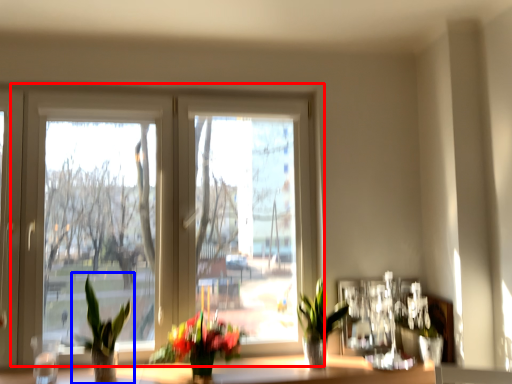
Question: Which object is closer to the camera taking this photo, window (highlighted by a red box) or houseplant (highlighted by a blue box)?

Choices:
 (A) window
 (B) houseplant

Answer: (B)